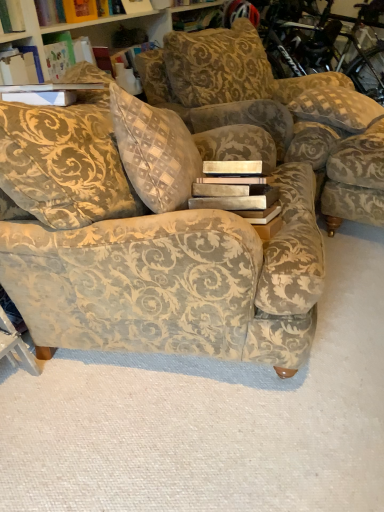
Question: Which is correct: checkered fabric pillow at upper right is inside velvet floral armchair at right, or outside of it?

Choices:
 (A) inside
 (B) outside

Answer: (B)

Question: From the image's perspective, is checkered fabric pillow at upper right located above or below velvet floral armchair at right?

Choices:
 (A) above
 (B) below

Answer: (A)

Question: Based on their relative distances, which object is nearer to the checkered fabric pillow at upper right?

Choices:
 (A) velvet-patterned couch at center
 (B) velvet floral armchair at right

Answer: (B)

Question: Estimate the real-world distances between objects in this image. Which object is closer to the checkered fabric pillow at upper right?

Choices:
 (A) velvet-patterned couch at center
 (B) velvet floral armchair at right

Answer: (B)